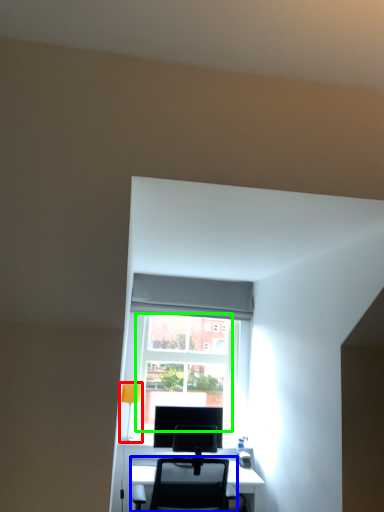
Question: Considering the real-world distances, which object is farthest from table lamp (highlighted by a red box)? chair (highlighted by a blue box) or glass door (highlighted by a green box)?

Choices:
 (A) chair
 (B) glass door

Answer: (A)